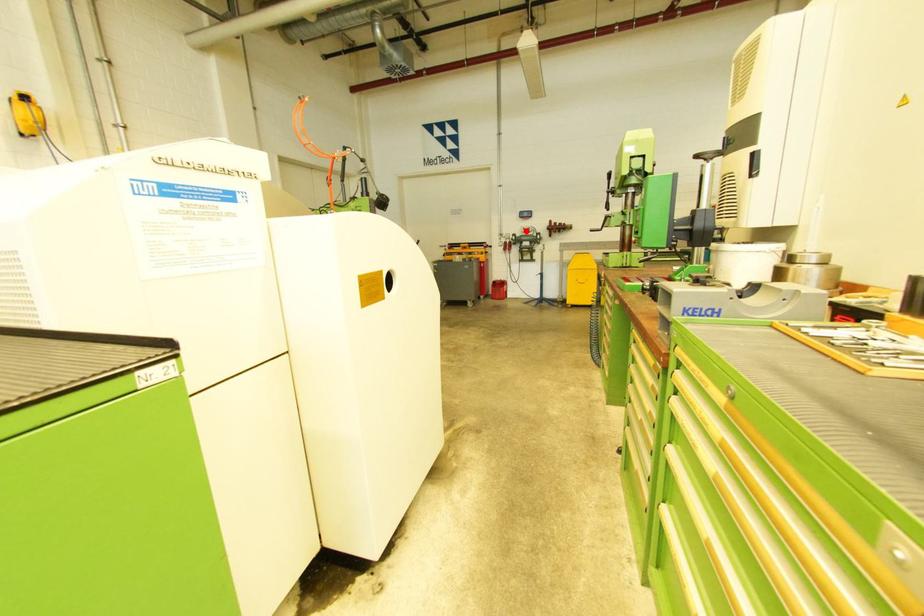
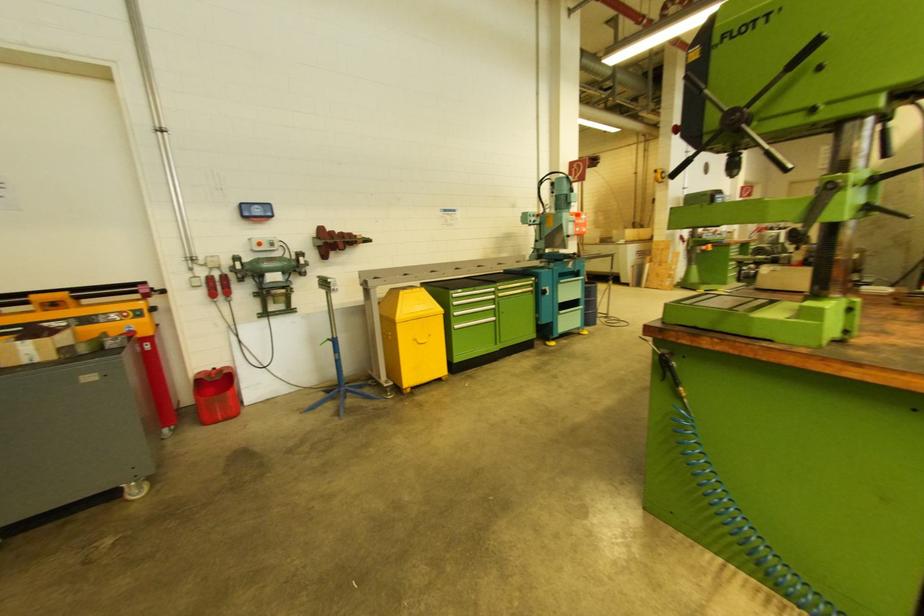
In the second image, find the point that corresponds to the highlighted location in the first image.

(261, 246)